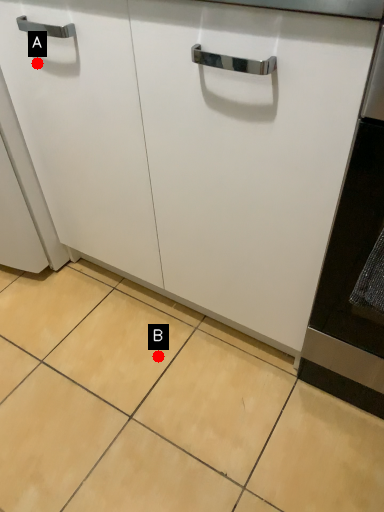
Question: Two points are circled on the image, labeled by A and B beside each circle. Among these points, which one is farthest from the camera?

Choices:
 (A) A is further
 (B) B is further

Answer: (B)